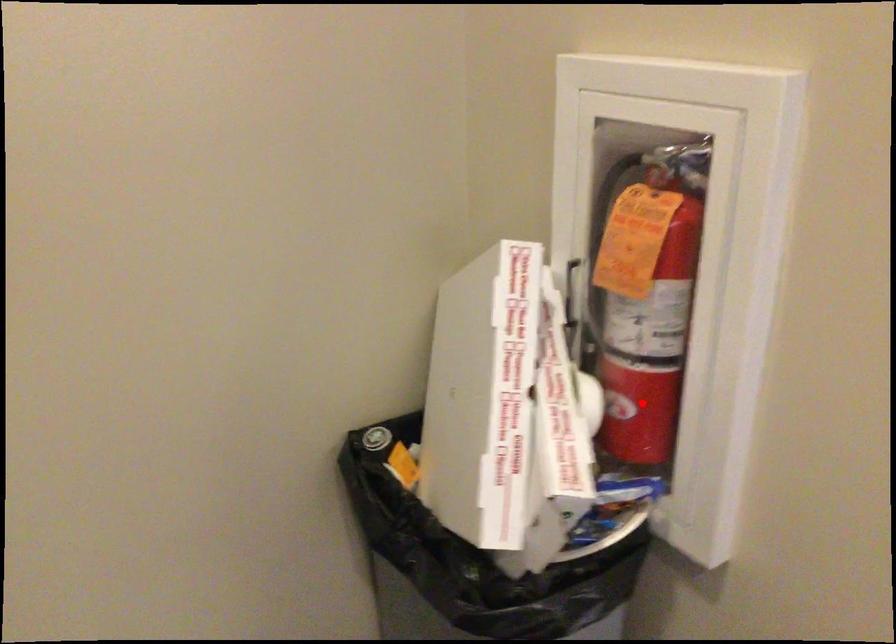
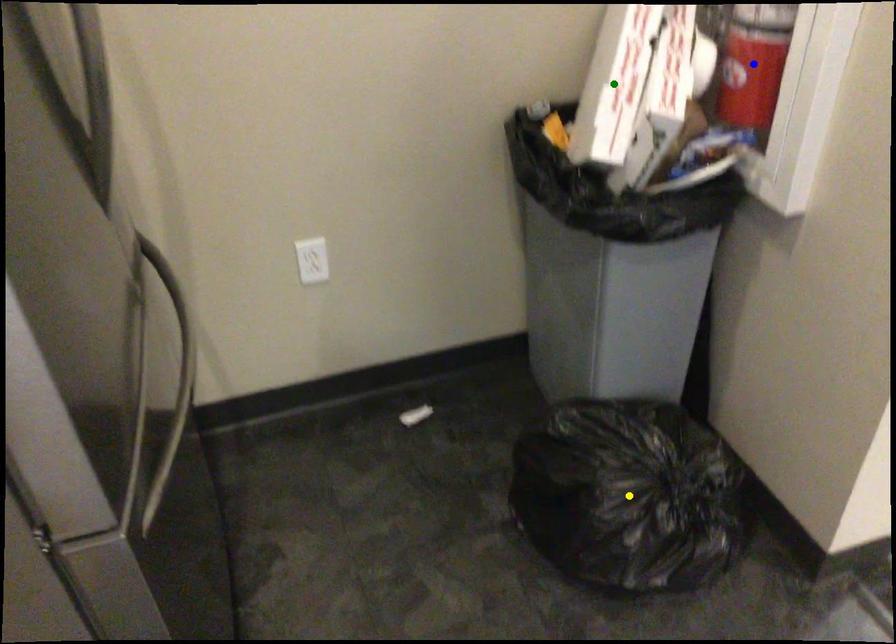
Question: I am providing you with two images of the same scene from different viewpoints. A red point is marked on the first image. You are given multiple points on the second image. In image 2, which mark is for the same physical point as the one in image 1?

Choices:
 (A) yellow point
 (B) green point
 (C) blue point

Answer: (C)